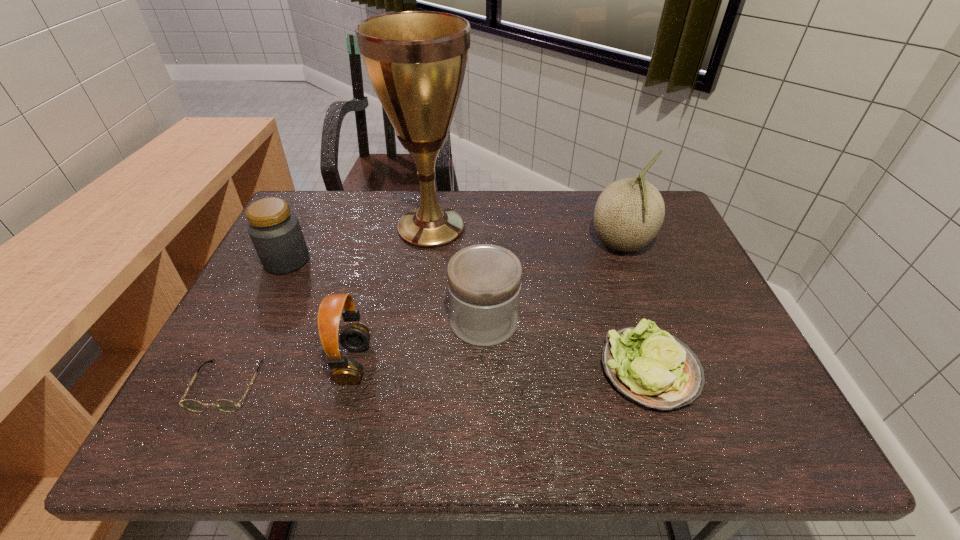
The height and width of the screenshot is (540, 960). In order to click on the tallest object in this screenshot , I will do `click(416, 61)`.

Locate an element on the screen. This screenshot has height=540, width=960. the sixth shortest object is located at coordinates (629, 213).

Find the location of `headset`. headset is located at coordinates (355, 337).

This screenshot has height=540, width=960. I want to click on the left jar, so click(276, 234).

The image size is (960, 540). I want to click on the nearer jar, so click(484, 281).

I want to click on lettuce, so click(649, 366).

Where is `the shortest object`? This screenshot has width=960, height=540. the shortest object is located at coordinates (225, 405).

The width and height of the screenshot is (960, 540). Identify the location of vacant area situated on the front of the trophy cup. (420, 316).

This screenshot has width=960, height=540. I want to click on vacant space positioned on the front of the cantaloup, so click(641, 301).

The height and width of the screenshot is (540, 960). I want to click on vacant area located on the ear cups of the headset, so click(457, 363).